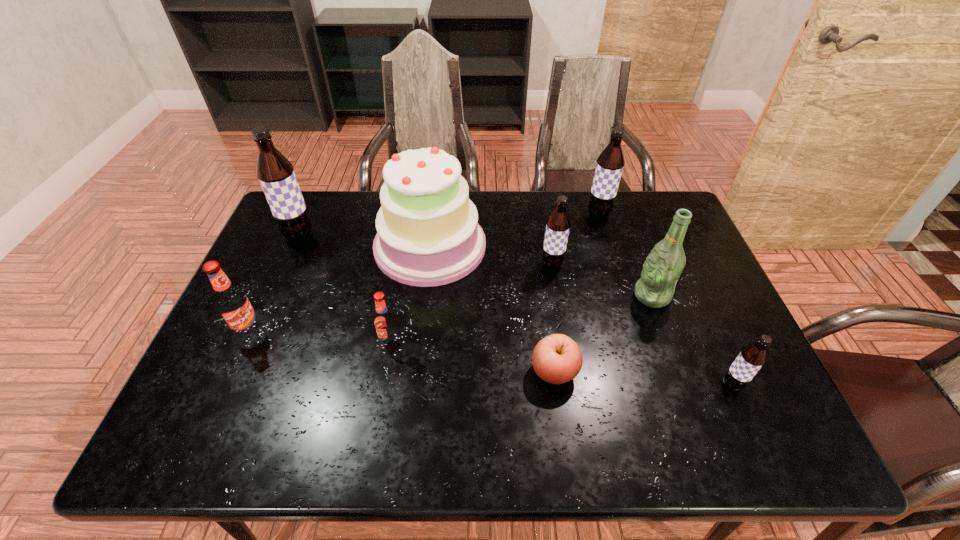
You are a GUI agent. You are given a task and a screenshot of the screen. Output one action in this format:
    pyautogui.click(x=<x>, y=<y>)
    Task: Click on the free spot between the nearest root beer and the green beer bottle
    
    Given the screenshot: What is the action you would take?
    pyautogui.click(x=692, y=340)

Image resolution: width=960 pixels, height=540 pixels. I want to click on vacant area between the second biggest brown root beer and the purple cake, so tap(515, 230).

I want to click on empty space between the second brown root beer from left to right and the rightmost root beer, so click(x=642, y=325).

At what (x,y) coordinates should I click in order to perform the action: click on vacant point located between the bigger red root beer and the smaller red root beer. Please return your answer as a coordinate pair (x, y). The width and height of the screenshot is (960, 540). Looking at the image, I should click on tap(320, 337).

The height and width of the screenshot is (540, 960). I want to click on object that is the sixth nearest to the fifth nearest root beer, so point(610,163).

Where is `the eighth closest object to the tallest object`? This screenshot has height=540, width=960. the eighth closest object to the tallest object is located at coordinates (751, 358).

Find the location of a particular element. The image size is (960, 540). root beer identified as the fourth closest to the purple cake is located at coordinates click(233, 304).

You are a GUI agent. You are given a task and a screenshot of the screen. Output one action in this format:
    pyautogui.click(x=<x>, y=<y>)
    Task: Click on the root beer that is the fourth closest to the second root beer from right to left
    This screenshot has height=540, width=960.
    Given the screenshot: What is the action you would take?
    [275, 173]

I want to click on brown root beer that is the third closest to the farthest root beer, so click(275, 173).

Identify which brown root beer is the second closest to the farthest root beer. Please provide its 2D coordinates. Your answer should be formatted as a tuple, i.e. [(x, y)], where the tuple contains the x and y coordinates of a point satisfying the conditions above.

[(751, 358)]